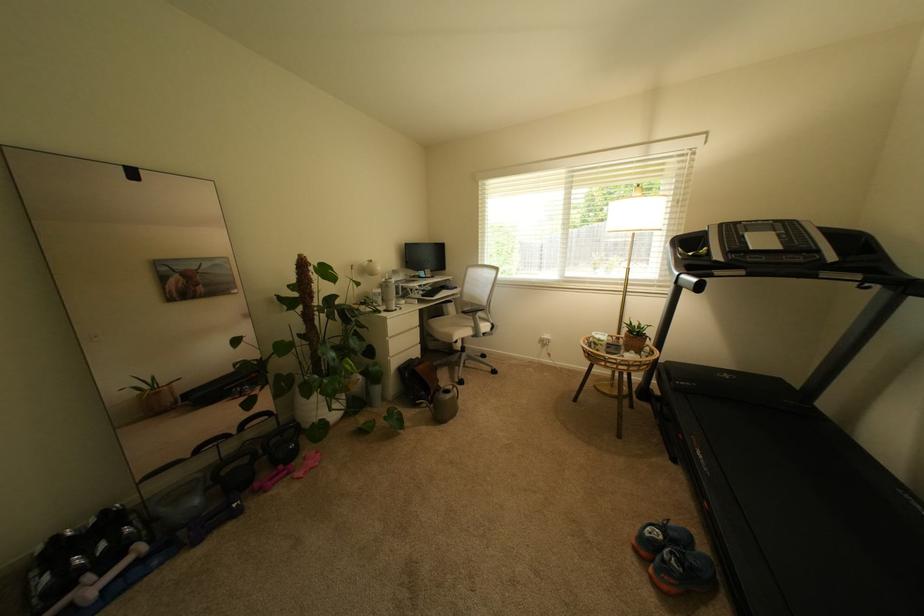
You are a GUI agent. You are given a task and a screenshot of the screen. Output one action in this format:
    pyautogui.click(x=<x>, y=<y>)
    Task: Click on the white chair surface
    Image resolution: width=924 pixels, height=616 pixels.
    Given the screenshot: What is the action you would take?
    pyautogui.click(x=464, y=331)